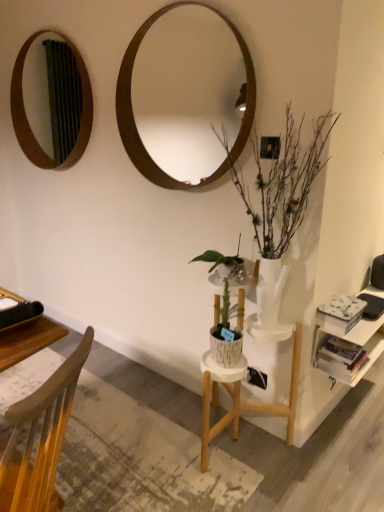
Where is `wooden chair at lower left`? Image resolution: width=384 pixels, height=512 pixels. wooden chair at lower left is located at coordinates (41, 437).

Describe the element at coordinates (340, 314) in the screenshot. I see `white matte book at right, acting as the 1th book starting from the top` at that location.

What is the approximate width of wooden mirror at upper center, marked as the second mirror in a back-to-front arrangement?

4.23 inches.

Measure the distance between white matte bookshelf at right and camera.

white matte bookshelf at right is 6.04 feet from camera.

Locate an element on the screen. white matte bookshelf at right is located at coordinates (351, 343).

Where is `white glossy vase at right`? The height and width of the screenshot is (512, 384). white glossy vase at right is located at coordinates (283, 184).

Identify the location of wooden chair at lower left. This screenshot has width=384, height=512. (41, 437).

Is hardcover book at right, which ranks as the 1th book in bottom-to-top order, to the left of wooden mirror at upper left, acting as the 2th mirror starting from the front, from the viewer's perspective?

In fact, hardcover book at right, which ranks as the 1th book in bottom-to-top order, is to the right of wooden mirror at upper left, acting as the 2th mirror starting from the front.

Is hardcover book at right, which ranks as the 1th book in bottom-to-top order, aimed at wooden mirror at upper left, acting as the 2th mirror starting from the front?

No.

From a real-world perspective, is hardcover book at right, the 2th book positioned from the top, positioned under wooden mirror at upper left, acting as the 2th mirror starting from the front, based on gravity?

Indeed, from a real-world perspective, hardcover book at right, the 2th book positioned from the top, is positioned beneath wooden mirror at upper left, acting as the 2th mirror starting from the front.

Does hardcover book at right, which ranks as the 1th book in bottom-to-top order, have a smaller size compared to wooden mirror at upper left, acting as the 2th mirror starting from the front?

Indeed, hardcover book at right, which ranks as the 1th book in bottom-to-top order, has a smaller size compared to wooden mirror at upper left, acting as the 2th mirror starting from the front.

Who is smaller, wooden chair at lower left or hardcover book at right, the 2th book positioned from the top?

hardcover book at right, the 2th book positioned from the top, is smaller.

From the image's perspective, starting from the wooden chair at lower left, which book is the 1st one above? Please provide its 2D coordinates.

[(341, 358)]

From a real-world perspective, who is located lower, wooden chair at lower left or hardcover book at right, the 2th book positioned from the top?

hardcover book at right, the 2th book positioned from the top, from a real-world perspective.

Does wooden chair at lower left have a larger size compared to white matte book at right, acting as the 1th book starting from the top?

Correct, wooden chair at lower left is larger in size than white matte book at right, acting as the 1th book starting from the top.

Between wooden chair at lower left and white matte book at right, acting as the 1th book starting from the top, which one is positioned behind?

Positioned behind is white matte book at right, acting as the 1th book starting from the top.

Identify the location of the 1st book behind the wooden chair at lower left, counting from the anchor's position. (340, 314).

Can you tell me how much wooden chair at lower left and white matte book at right, the 2th book ordered from the bottom, differ in facing direction?

There is a 157-degree angle between the facing directions of wooden chair at lower left and white matte book at right, the 2th book ordered from the bottom.

Consider the image. Is white matte bookshelf at right completely or partially outside of white glossy vase at right?

Answer: Absolutely, white matte bookshelf at right is external to white glossy vase at right.

Does white matte bookshelf at right turn towards white glossy vase at right?

No, white matte bookshelf at right is not oriented towards white glossy vase at right.

Which object is further away from the camera, white matte bookshelf at right or white glossy vase at right?

white matte bookshelf at right is further from the camera.

How many degrees apart are the facing directions of white glossy vase at right and wooden mirror at upper left, acting as the 2th mirror starting from the front?

0.00665 degrees separate the facing orientations of white glossy vase at right and wooden mirror at upper left, acting as the 2th mirror starting from the front.

Consider the image. Between white glossy vase at right and wooden mirror at upper left, arranged as the 1th mirror when viewed from the back, which one appears on the right side from the viewer's perspective?

Positioned to the right is white glossy vase at right.

From the image's perspective, which one is positioned lower, white glossy vase at right or wooden mirror at upper left, the 2th mirror from the right?

white glossy vase at right.

Who is taller, white glossy vase at right or wooden mirror at upper left, arranged as the 1th mirror when viewed from the back?

Standing taller between the two is white glossy vase at right.

How many degrees apart are the facing directions of white matte book at right, acting as the 1th book starting from the top, and hardcover book at right, which ranks as the 1th book in bottom-to-top order?

They differ by 0.00128 degrees in their facing directions.

Measure the distance between white matte book at right, the 2th book ordered from the bottom, and hardcover book at right, which ranks as the 1th book in bottom-to-top order.

A distance of 4.80 inches exists between white matte book at right, the 2th book ordered from the bottom, and hardcover book at right, which ranks as the 1th book in bottom-to-top order.

From the image's perspective, is white matte book at right, the 2th book ordered from the bottom, located above or below hardcover book at right, the 2th book positioned from the top?

Based on their image positions, white matte book at right, the 2th book ordered from the bottom, is located above hardcover book at right, the 2th book positioned from the top.

Is point (346, 295) positioned after point (319, 367)?

Yes, it is.

Which object is positioned more to the left, wooden mirror at upper center, marked as the second mirror in a back-to-front arrangement, or wooden mirror at upper left, arranged as the 1th mirror when viewed from the back?

wooden mirror at upper left, arranged as the 1th mirror when viewed from the back.

Which object is closer to the camera, wooden mirror at upper center, which ranks as the 1th mirror in right-to-left order, or wooden mirror at upper left, placed as the first mirror when sorted from left to right?

wooden mirror at upper center, which ranks as the 1th mirror in right-to-left order, is closer to the camera.

From the image's perspective, does wooden mirror at upper center, which is the 2th mirror in left-to-right order, appear lower than wooden mirror at upper left, arranged as the 1th mirror when viewed from the back?

Correct, wooden mirror at upper center, which is the 2th mirror in left-to-right order, appears lower than wooden mirror at upper left, arranged as the 1th mirror when viewed from the back, in the image.

Considering the relative sizes of wooden mirror at upper center, which ranks as the 1th mirror in right-to-left order, and wooden mirror at upper left, placed as the first mirror when sorted from left to right, in the image provided, is wooden mirror at upper center, which ranks as the 1th mirror in right-to-left order, shorter than wooden mirror at upper left, placed as the first mirror when sorted from left to right,?

No.

Find the location of a particular element. The image size is (384, 512). mirror that is the 2nd object to the left of the hardcover book at right, which ranks as the 1th book in bottom-to-top order, starting at the anchor is located at coordinates (54, 95).

What are the coordinates of `chair in front of the hardcover book at right, the 2th book positioned from the top` in the screenshot? It's located at (41, 437).

When comparing their distances from wooden mirror at upper left, acting as the 2th mirror starting from the front, does white matte bookshelf at right or white glossy vase at right seem closer?

white glossy vase at right is closer to wooden mirror at upper left, acting as the 2th mirror starting from the front.

Which object lies nearer to the anchor point hardcover book at right, which ranks as the 1th book in bottom-to-top order, wooden mirror at upper center, marked as the second mirror in a back-to-front arrangement, or wooden chair at lower left?

wooden chair at lower left is positioned closer to the anchor hardcover book at right, which ranks as the 1th book in bottom-to-top order.

Looking at the image, which one is located further to white matte book at right, acting as the 1th book starting from the top, white matte bookshelf at right or wooden mirror at upper left, placed as the first mirror when sorted from left to right?

wooden mirror at upper left, placed as the first mirror when sorted from left to right.

Which object lies nearer to the anchor point hardcover book at right, the 2th book positioned from the top, wooden chair at lower left or white glossy vase at right?

white glossy vase at right lies closer to hardcover book at right, the 2th book positioned from the top, than the other object.

Looking at the image, which one is located closer to white matte bookshelf at right, hardcover book at right, the 2th book positioned from the top, or wooden chair at lower left?

Among the two, hardcover book at right, the 2th book positioned from the top, is located nearer to white matte bookshelf at right.

From the image, which object appears to be nearer to wooden mirror at upper center, which is the 2th mirror in left-to-right order, hardcover book at right, the 2th book positioned from the top, or white matte bookshelf at right?

Among the two, white matte bookshelf at right is located nearer to wooden mirror at upper center, which is the 2th mirror in left-to-right order.

Which object lies nearer to the anchor point wooden chair at lower left, white glossy vase at right or hardcover book at right, which ranks as the 1th book in bottom-to-top order?

Based on the image, white glossy vase at right appears to be nearer to wooden chair at lower left.

From the picture: Looking at the image, which one is located closer to hardcover book at right, which ranks as the 1th book in bottom-to-top order, wooden mirror at upper left, acting as the 2th mirror starting from the front, or white matte bookshelf at right?

white matte bookshelf at right is closer to hardcover book at right, which ranks as the 1th book in bottom-to-top order.

The image size is (384, 512). Identify the location of houseplant between wooden mirror at upper left, acting as the 2th mirror starting from the front, and white matte book at right, the 2th book ordered from the bottom, from left to right. (283, 184).

This screenshot has width=384, height=512. Find the location of `mirror between wooden mirror at upper left, the 2th mirror from the right, and white matte book at right, the 2th book ordered from the bottom`. mirror between wooden mirror at upper left, the 2th mirror from the right, and white matte book at right, the 2th book ordered from the bottom is located at coordinates (187, 90).

Locate an element on the screen. The height and width of the screenshot is (512, 384). houseplant between wooden mirror at upper center, which ranks as the 1th mirror in right-to-left order, and white matte bookshelf at right, in the vertical direction is located at coordinates (283, 184).

Find the location of a particular element. The height and width of the screenshot is (512, 384). shelf between wooden mirror at upper center, which is the 2th mirror in left-to-right order, and wooden chair at lower left vertically is located at coordinates (351, 343).